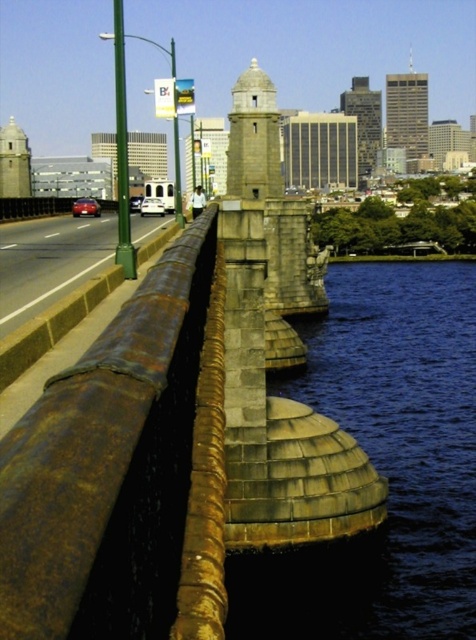
Question: Among these objects, which one is farthest from the camera?

Choices:
 (A) rusty metal rail at center-left
 (B) rustic stone bell tower at center
 (C) gold textured skyscraper at upper center
 (D) rustic stone tower at upper center

Answer: (C)

Question: Does gold textured skyscraper at upper center have a larger size compared to rustic stone tower at upper center?

Choices:
 (A) no
 (B) yes

Answer: (A)

Question: Which object appears farthest from the camera in this image?

Choices:
 (A) rusty metal rail at center-left
 (B) gold textured skyscraper at upper center
 (C) rustic stone bell tower at center
 (D) rustic stone tower at upper center

Answer: (B)

Question: Estimate the real-world distances between objects in this image. Which object is closer to the rusty metal rail at center-left?

Choices:
 (A) rustic stone bell tower at center
 (B) rustic stone tower at upper center
 (C) gold textured skyscraper at upper center

Answer: (A)

Question: Can you confirm if gold textured skyscraper at upper center is positioned above rustic stone tower at upper center?

Choices:
 (A) no
 (B) yes

Answer: (B)

Question: Does rustic stone bell tower at center have a greater width compared to rustic stone tower at upper center?

Choices:
 (A) yes
 (B) no

Answer: (B)